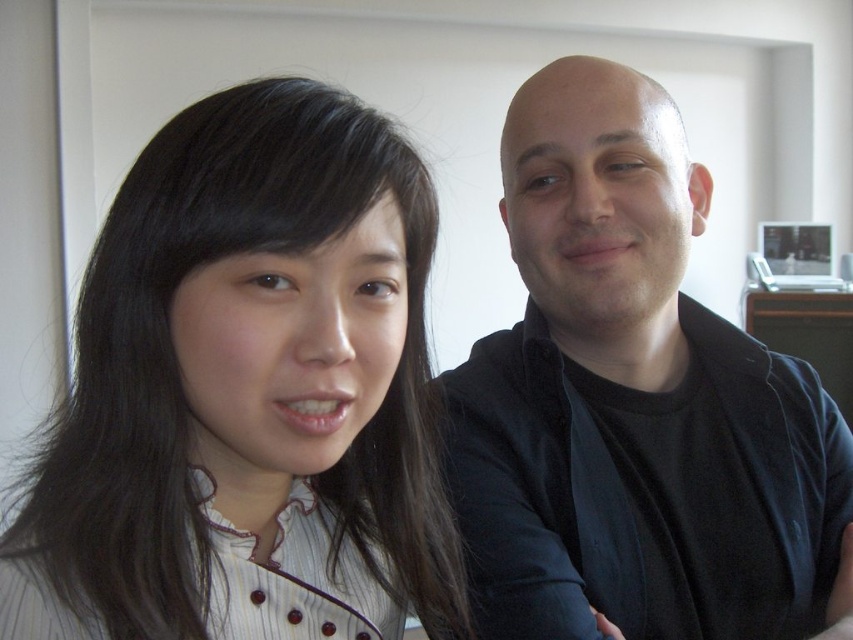
Between matte black hair at left and black matte shirt at right, which one is positioned lower?

matte black hair at left is lower down.

Is point (202, 108) more distant than point (699, 628)?

That is False.

Which is in front, point (82, 444) or point (814, 604)?

Point (82, 444)

Where is `matte black hair at left`? matte black hair at left is located at coordinates (248, 394).